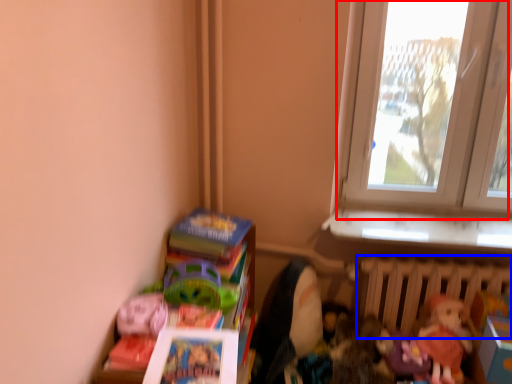
Question: Which point is closer to the camera, window (highlighted by a red box) or radiator (highlighted by a blue box)?

Choices:
 (A) window
 (B) radiator

Answer: (A)